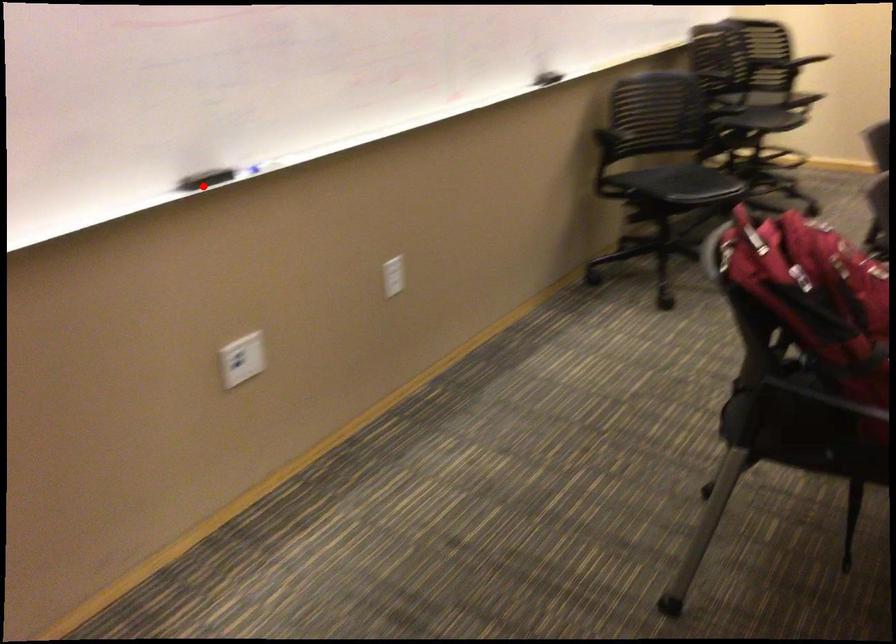
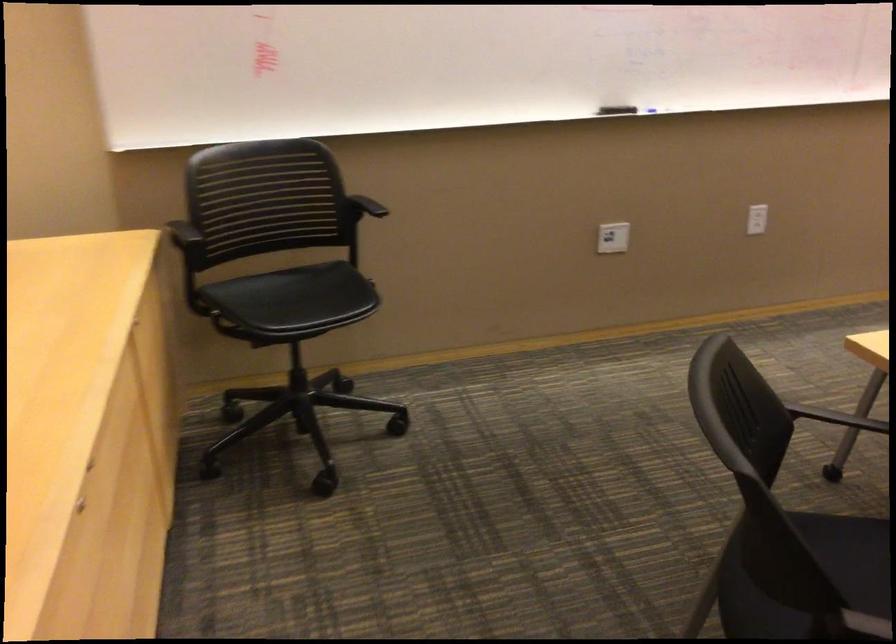
Question: I am providing you with two images of the same scene from different viewpoints. Image1 has a red point marked. In image2, the corresponding 3D location appears at what relative position? Reply with the corresponding letter.

Choices:
 (A) Closer
 (B) Farther

Answer: (B)